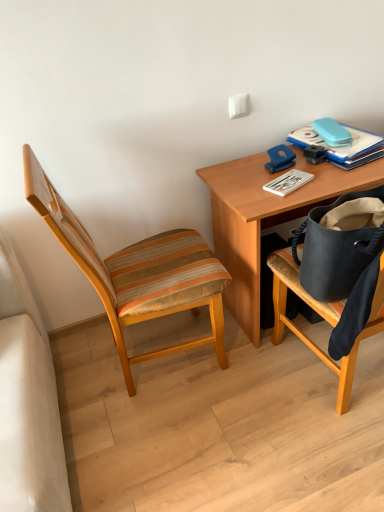
Question: Relative to wooden striped chair at left, is white matte paperback book at upper right, the second paperback book when ordered from right to left, in front or behind?

Choices:
 (A) front
 (B) behind

Answer: (B)

Question: Is white matte paperback book at upper right, which is the 2th paperback book from top to bottom, to the left or to the right of wooden striped chair at left in the image?

Choices:
 (A) left
 (B) right

Answer: (B)

Question: Which object is the closest to the blue hardcover book at upper right, arranged as the 2th paperback book when ordered from the bottom?

Choices:
 (A) wooden desk at upper right
 (B) wooden striped chair at left
 (C) white matte paperback book at upper right, which is the first paperback book from bottom to top

Answer: (C)

Question: Which is farther from the blue hardcover book at upper right, arranged as the 2th paperback book when ordered from the bottom?

Choices:
 (A) white matte paperback book at upper right, positioned as the first paperback book in left-to-right order
 (B) wooden desk at upper right
 (C) wooden striped chair at left

Answer: (C)